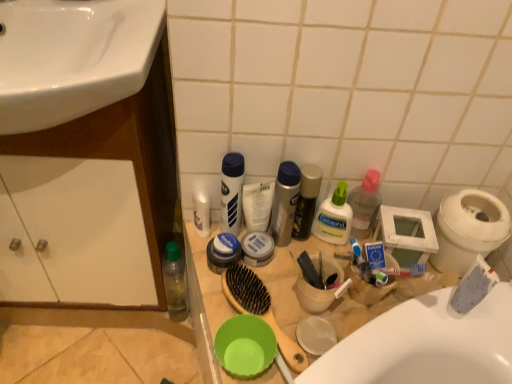
Locate an element on the screen. The image size is (512, 384). vacant point above wooden counter top at center (from a real-world perspective) is located at coordinates (308, 314).